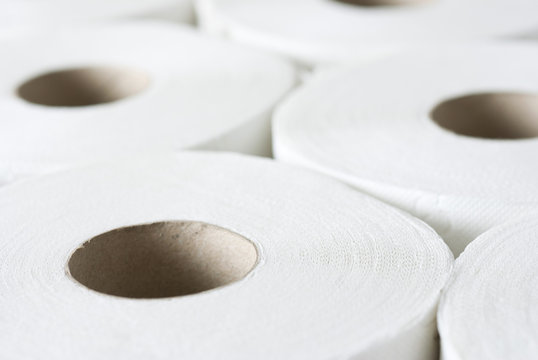
Where is `toilet paper`? The image size is (538, 360). toilet paper is located at coordinates (348, 254), (437, 175), (209, 116), (463, 305), (345, 24).